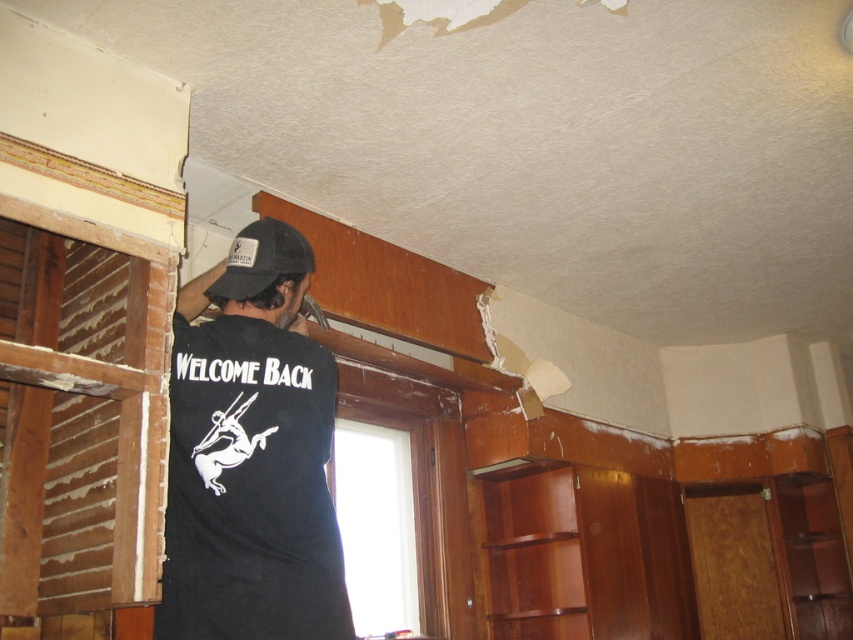
From the picture: Is black matte t-shirt at center above black fabric baseball cap at upper center?

Incorrect, black matte t-shirt at center is not positioned above black fabric baseball cap at upper center.

Between black matte t-shirt at center and black fabric baseball cap at upper center, which one is positioned higher?

black fabric baseball cap at upper center is above.

Where is `black matte t-shirt at center`? black matte t-shirt at center is located at coordinates (250, 456).

Locate an element on the screen. black matte t-shirt at center is located at coordinates (250, 456).